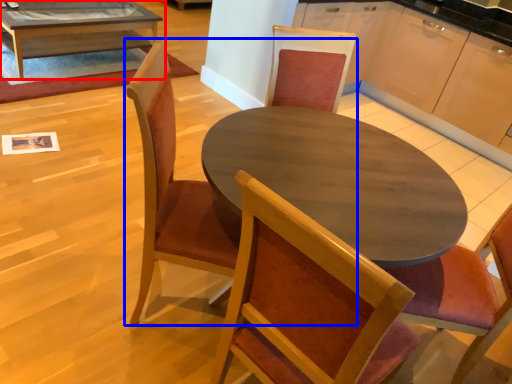
Question: Which point is further to the camera, coffee table (highlighted by a red box) or chair (highlighted by a blue box)?

Choices:
 (A) coffee table
 (B) chair

Answer: (A)